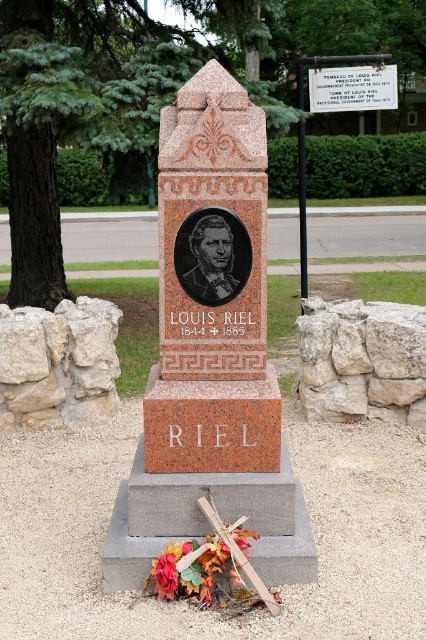
Question: Considering the relative positions of gray rough stone wall at right and white marble plaque at upper center in the image provided, where is gray rough stone wall at right located with respect to white marble plaque at upper center?

Choices:
 (A) left
 (B) right

Answer: (A)

Question: Does gray rough stone wall at right have a larger size compared to black polished stone portrait at center?

Choices:
 (A) yes
 (B) no

Answer: (A)

Question: Which point is closer to the camera?

Choices:
 (A) (412, 307)
 (B) (201, 580)
 (C) (184, 168)
 (D) (218, 276)

Answer: (B)

Question: Estimate the real-world distances between objects in this image. Which object is closer to the red granite monument at center?

Choices:
 (A) black polished stone portrait at center
 (B) white marble plaque at upper center

Answer: (A)

Question: Is the position of red granite monument at center more distant than that of white marble plaque at upper center?

Choices:
 (A) no
 (B) yes

Answer: (A)

Question: Which of these objects is positioned closest to the white marble plaque at upper center?

Choices:
 (A) red granite monument at center
 (B) gray rough stone wall at right

Answer: (B)